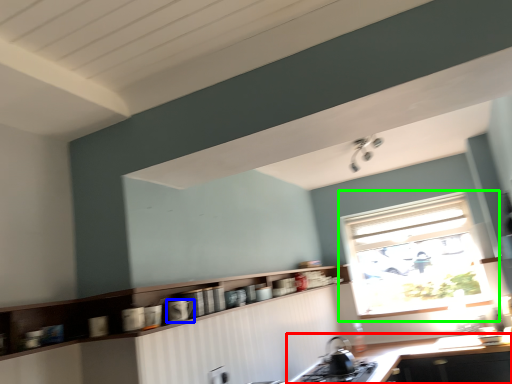
Question: Considering the real-world distances, which object is farthest from countertop (highlighted by a red box)? appliance (highlighted by a blue box) or window (highlighted by a green box)?

Choices:
 (A) appliance
 (B) window

Answer: (A)